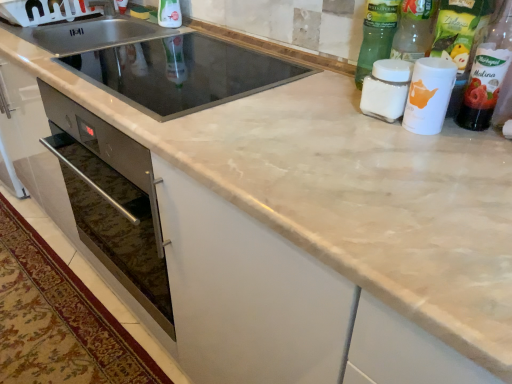
Question: Which direction should I rotate to face black glass sink at center, positioned as the 2th sink in back-to-front order, — up or down?

Choices:
 (A) up
 (B) down

Answer: (A)

Question: Is white matte cup at upper right, marked as the 4th bottle in a left-to-right arrangement, directly adjacent to green glass bottle at upper right, positioned as the fourth bottle in right-to-left order?

Choices:
 (A) yes
 (B) no

Answer: (B)

Question: Considering the relative sizes of white matte cup at upper right, marked as the 4th bottle in a left-to-right arrangement, and green glass bottle at upper right, positioned as the fourth bottle in right-to-left order, in the image provided, is white matte cup at upper right, marked as the 4th bottle in a left-to-right arrangement, wider than green glass bottle at upper right, positioned as the fourth bottle in right-to-left order,?

Choices:
 (A) yes
 (B) no

Answer: (B)

Question: From the image's perspective, does white matte cup at upper right, marked as the 4th bottle in a left-to-right arrangement, appear higher than green glass bottle at upper right, positioned as the fourth bottle in right-to-left order?

Choices:
 (A) yes
 (B) no

Answer: (B)

Question: Is white matte cup at upper right, which ranks as the 3th bottle in right-to-left order, completely or partially outside of green glass bottle at upper right, the 3th bottle positioned from the left?

Choices:
 (A) no
 (B) yes

Answer: (B)

Question: Is white matte cup at upper right, which ranks as the 3th bottle in right-to-left order, not close to green glass bottle at upper right, positioned as the fourth bottle in right-to-left order?

Choices:
 (A) yes
 (B) no

Answer: (B)

Question: Can you confirm if white matte cup at upper right, marked as the 4th bottle in a left-to-right arrangement, is taller than green glass bottle at upper right, positioned as the fourth bottle in right-to-left order?

Choices:
 (A) no
 (B) yes

Answer: (A)

Question: Is white matte cup at upper right, which ranks as the 3th bottle in right-to-left order, a part of black glass sink at center, positioned as the 2th sink in back-to-front order?

Choices:
 (A) no
 (B) yes

Answer: (A)

Question: Is black glass sink at center, the first sink in the front-to-back sequence, far away from white matte cup at upper right, which ranks as the 3th bottle in right-to-left order?

Choices:
 (A) yes
 (B) no

Answer: (B)

Question: Considering the relative sizes of black glass sink at center, the first sink in the front-to-back sequence, and white matte cup at upper right, marked as the 4th bottle in a left-to-right arrangement, in the image provided, is black glass sink at center, the first sink in the front-to-back sequence, shorter than white matte cup at upper right, marked as the 4th bottle in a left-to-right arrangement,?

Choices:
 (A) no
 (B) yes

Answer: (B)

Question: Does black glass sink at center, positioned as the 2th sink in back-to-front order, lie in front of white matte cup at upper right, which ranks as the 3th bottle in right-to-left order?

Choices:
 (A) no
 (B) yes

Answer: (A)

Question: From a real-world perspective, is black glass sink at center, positioned as the 2th sink in back-to-front order, located higher than white matte cup at upper right, marked as the 4th bottle in a left-to-right arrangement?

Choices:
 (A) no
 (B) yes

Answer: (A)

Question: Considering the relative sizes of black glass sink at center, positioned as the 2th sink in back-to-front order, and white matte cup at upper right, which ranks as the 3th bottle in right-to-left order, in the image provided, is black glass sink at center, positioned as the 2th sink in back-to-front order, smaller than white matte cup at upper right, which ranks as the 3th bottle in right-to-left order,?

Choices:
 (A) no
 (B) yes

Answer: (A)

Question: Is black glass sink at center, the first sink in the front-to-back sequence, next to translucent plastic bottle at upper right, which is the 1th bottle from right to left?

Choices:
 (A) yes
 (B) no

Answer: (B)